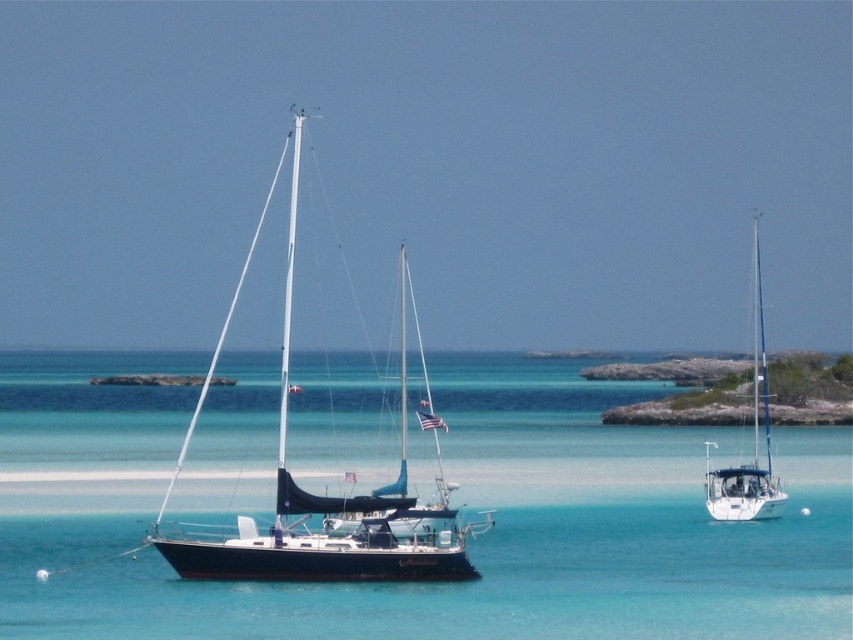
You are a sailor planning to anchor your boat in the area between the clear blue water at center and the white glossy sailboat at right. The minimum safe distance required between anchored boats is 50 feet. Can you safely anchor your boat in this location?

The distance between the clear blue water at center and the white glossy sailboat at right is 84.04 feet, which exceeds the minimum safe distance of 50 feet. Therefore, you can safely anchor your boat in this location.

In the scene shown: You are standing on the deck of the larger sailboat and want to locate the clear blue water at center. Which direction should you look to see it?

The clear blue water at center is located at point coordinates of (450, 500), so you should look towards the center of the image to see it.

You are an observer on a boat and see the clear blue water at center and the white glossy sailboat at right. Which object takes up more space in the image?

The white glossy sailboat at right takes up more space in the image than the clear blue water at center, as the water occupies less space.